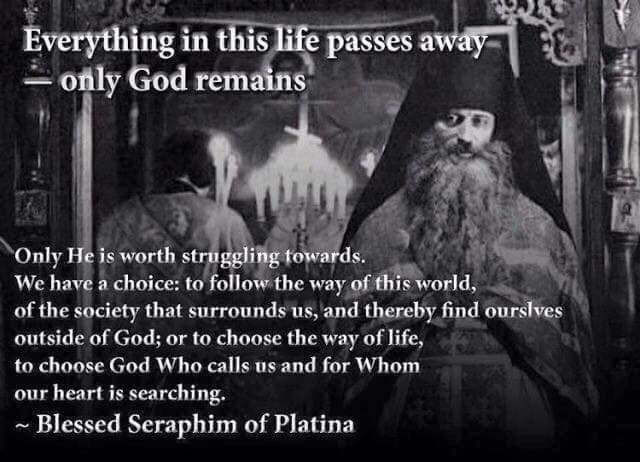
Where is `robe`? The height and width of the screenshot is (462, 640). robe is located at coordinates (520, 266), (386, 250).